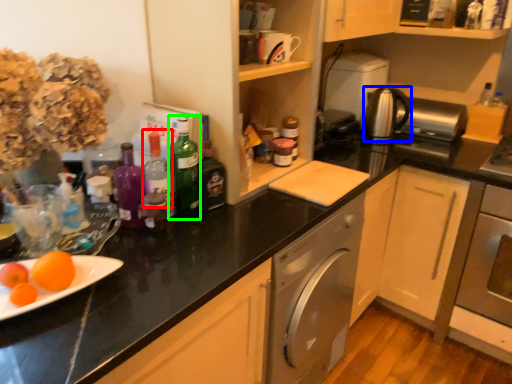
Question: Which object is positioned farthest from bottle (highlighted by a red box)? Select from kitchen appliance (highlighted by a blue box) and bottle (highlighted by a green box).

Choices:
 (A) kitchen appliance
 (B) bottle

Answer: (A)